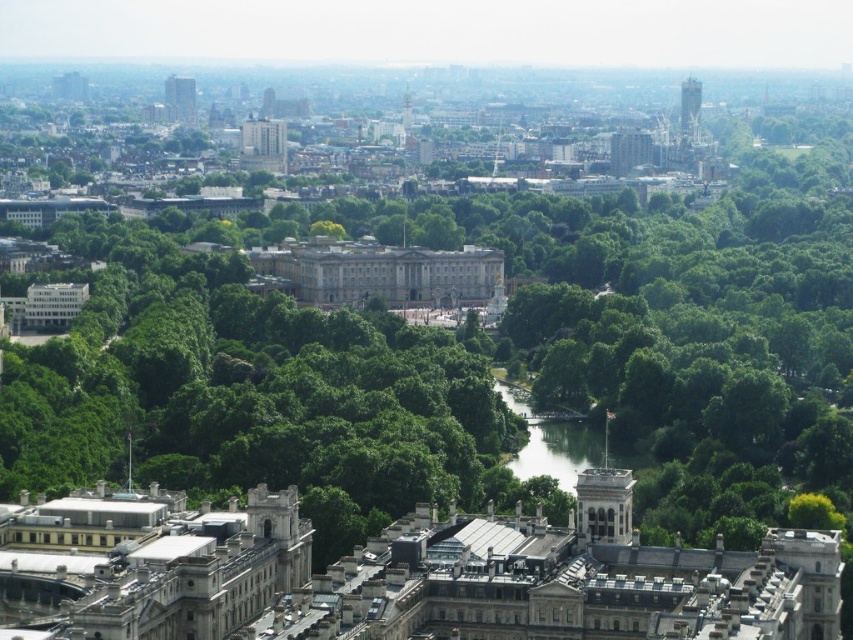
You are a tourist in London and want to walk from the green leafy trees at center to the green grassy river at center. Given that your average walking speed is 1.4 meters per second, how many seconds will it take you to reach the river?

The distance between the green leafy trees at center and the green grassy river at center is 40.81 meters. At a walking speed of 1.4 meters per second, dividing the distance by speed gives approximately 29.15 seconds. Therefore, it will take roughly 29 seconds to reach the river.

You are a tourist standing in the park area near Buckingham Palace. You see the green leafy trees at center and the green grassy river at center. Which one is closer to you?

The green leafy trees at center are closer to you than the green grassy river at center because the trees are positioned further to the viewer.

You are standing in front of Buckingham Palace and want to take a photo that includes both the point at coordinates point (305,337) and point (563,436). Which point should you focus on first to ensure both are in focus?

You should focus on point (305,337) first because it is closer to the camera than point (563,436). This ensures that both points will be in focus as the camera adjusts the depth of field.